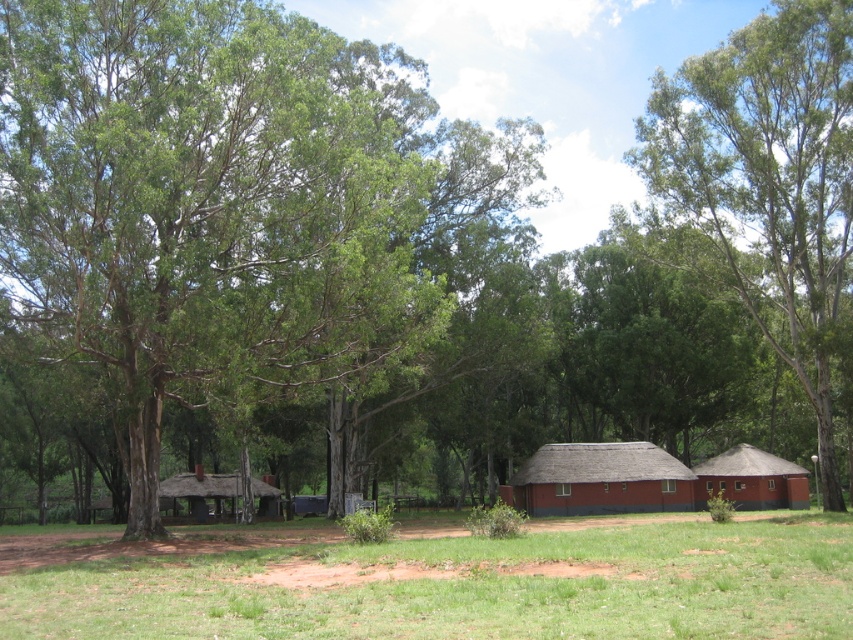
Who is positioned more to the right, green leafy tree at upper right or thatched straw hut at center?

green leafy tree at upper right is more to the right.

Does green leafy tree at upper right come in front of thatched straw hut at center?

Yes.

Locate an element on the screen. The height and width of the screenshot is (640, 853). green leafy tree at upper right is located at coordinates (769, 179).

Which is more to the left, green grass at lower center or thatched straw hut at center?

thatched straw hut at center is more to the left.

I want to click on green grass at lower center, so click(438, 579).

Identify the location of green grass at lower center. (438, 579).

What do you see at coordinates (438, 579) in the screenshot?
I see `green grass at lower center` at bounding box center [438, 579].

Is green grass at lower center further to the viewer compared to green leafy tree at upper right?

That is False.

What are the coordinates of `green grass at lower center` in the screenshot? It's located at (438, 579).

You are a GUI agent. You are given a task and a screenshot of the screen. Output one action in this format:
    pyautogui.click(x=<x>, y=<y>)
    Task: Click on the green grass at lower center
    The image size is (853, 640).
    Given the screenshot: What is the action you would take?
    pyautogui.click(x=438, y=579)